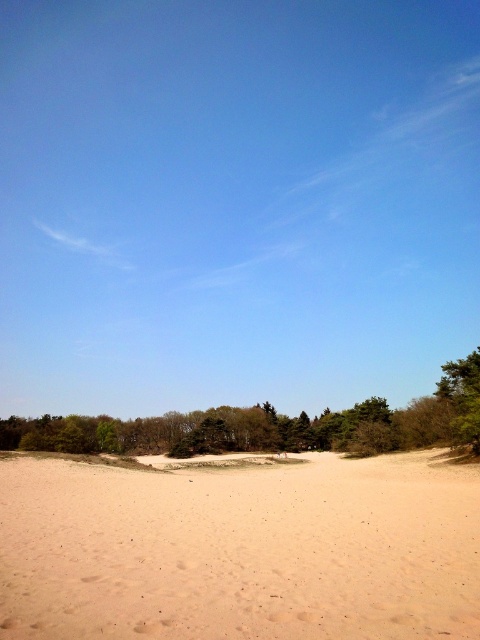
Between light brown sandy at center and green leafy tree at lower left, which one appears on the left side from the viewer's perspective?

light brown sandy at center is more to the left.

Who is positioned more to the right, light brown sandy at center or green leafy tree at lower left?

From the viewer's perspective, green leafy tree at lower left appears more on the right side.

Is point (410, 554) less distant than point (267, 445)?

Yes, it is in front of point (267, 445).

Locate an element on the screen. light brown sandy at center is located at coordinates (240, 550).